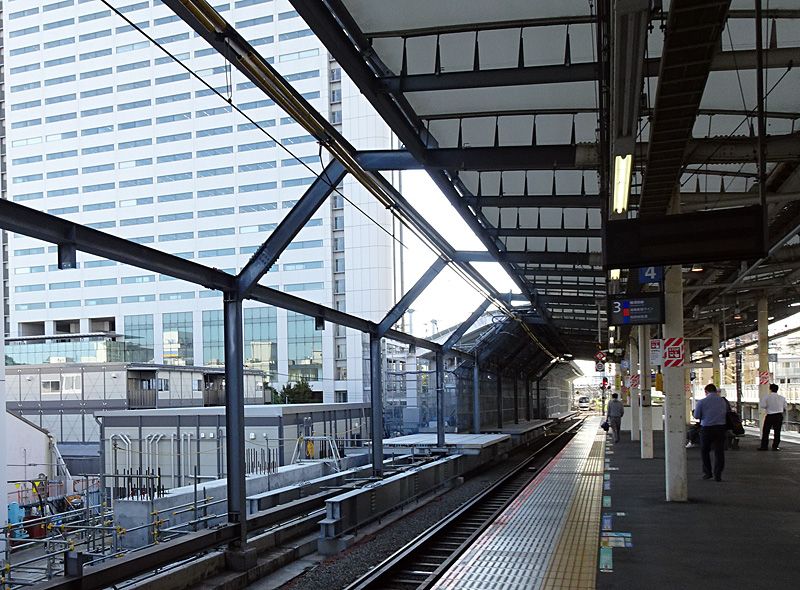
The height and width of the screenshot is (590, 800). What are the coordinates of `ceiling lights` in the screenshot? It's located at (613, 189), (616, 271), (610, 329), (610, 340), (610, 350).